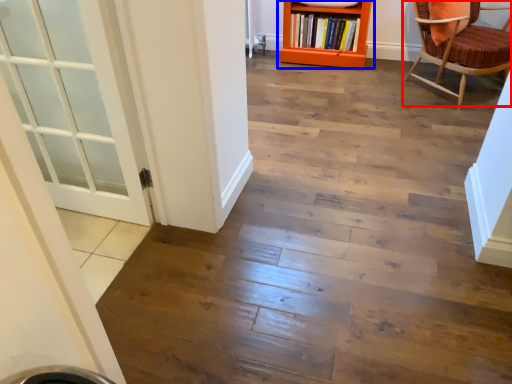
Question: Which object appears farthest to the camera in this image, chair (highlighted by a red box) or bookcase (highlighted by a blue box)?

Choices:
 (A) chair
 (B) bookcase

Answer: (B)